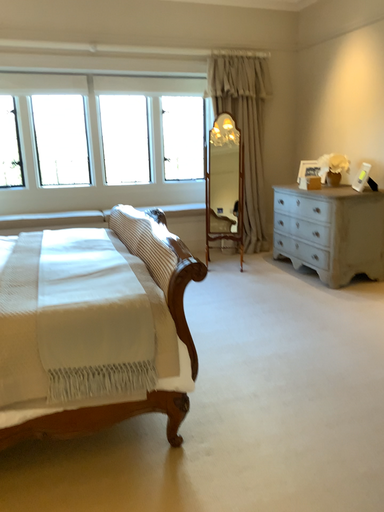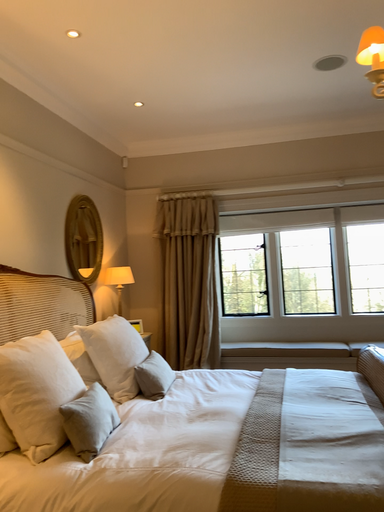
Question: Which way did the camera rotate in the video?

Choices:
 (A) rotated upward
 (B) rotated downward

Answer: (A)